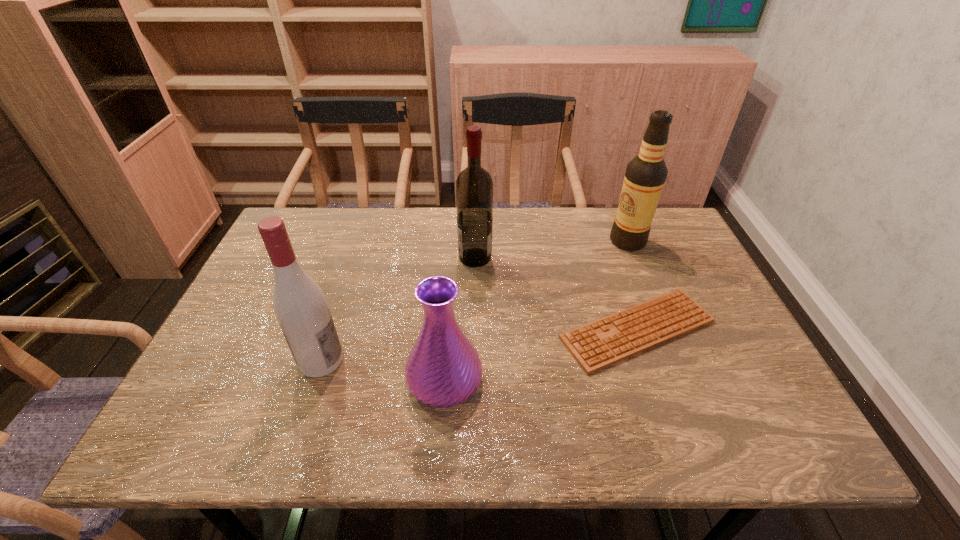
Where is `unoccupied area between the rightmost alcohol and the computer keyboard`? This screenshot has width=960, height=540. unoccupied area between the rightmost alcohol and the computer keyboard is located at coordinates (633, 285).

Locate an element on the screen. This screenshot has width=960, height=540. free area in between the rightmost alcohol and the fourth tallest object is located at coordinates (537, 310).

The width and height of the screenshot is (960, 540). I want to click on free space that is in between the second alcohol from right to left and the leftmost alcohol, so click(398, 309).

Choose which object is the fourth nearest neighbor to the computer keyboard. Please provide its 2D coordinates. Your answer should be formatted as a tuple, i.e. [(x, y)], where the tuple contains the x and y coordinates of a point satisfying the conditions above.

[(300, 306)]

At what (x,y) coordinates should I click in order to perform the action: click on the closest object to the vase. Please return your answer as a coordinate pair (x, y). The width and height of the screenshot is (960, 540). Looking at the image, I should click on tap(300, 306).

Where is `the closest alcohol relative to the second shortest object`? This screenshot has height=540, width=960. the closest alcohol relative to the second shortest object is located at coordinates (300, 306).

The height and width of the screenshot is (540, 960). Identify the location of alcohol object that ranks as the second closest to the rightmost alcohol. [x=300, y=306].

The width and height of the screenshot is (960, 540). What are the coordinates of `free point that satisfies the following two spatial constraints: 1. on the front and back of the shortest object; 2. on the right side of the second alcohol from right to left` in the screenshot? It's located at (474, 329).

Where is `free space that satisfies the following two spatial constraints: 1. on the front and back of the computer keyboard; 2. on the left side of the second alcohol from right to left`? The height and width of the screenshot is (540, 960). free space that satisfies the following two spatial constraints: 1. on the front and back of the computer keyboard; 2. on the left side of the second alcohol from right to left is located at coordinates tap(474, 329).

This screenshot has height=540, width=960. Find the location of `free location that satisfies the following two spatial constraints: 1. on the back side of the computer keyboard; 2. on the right side of the vase`. free location that satisfies the following two spatial constraints: 1. on the back side of the computer keyboard; 2. on the right side of the vase is located at coordinates (448, 329).